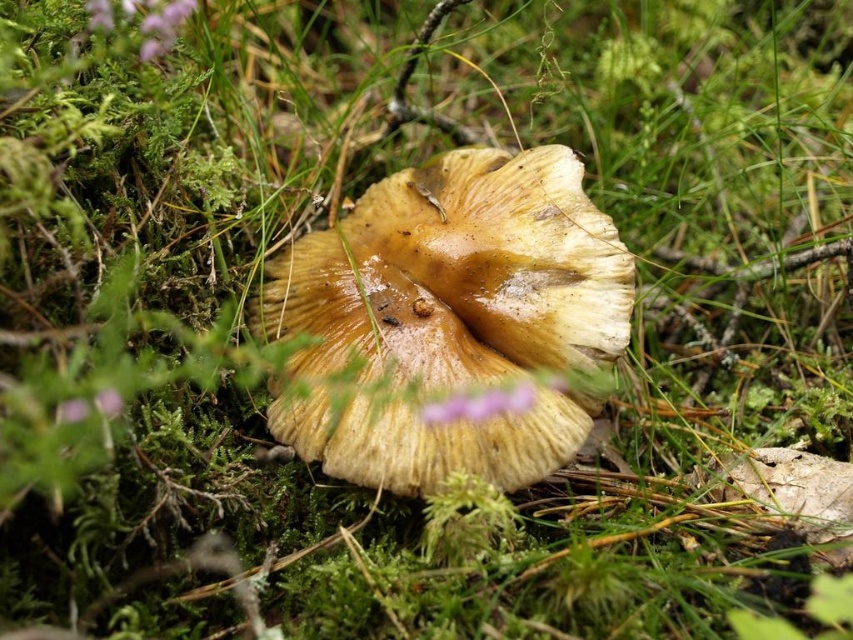
You are a botanist studying the spatial distribution of mushrooms in a forest. You have a map with coordinates. Where is the brown textured mushroom at center located on the map?

The brown textured mushroom at center is located at coordinates point (457, 275).

You are a botanist examining the forest floor. You notice the brown textured mushroom at center and the purple matte flower at upper left. Which object is positioned higher in the image?

The purple matte flower at upper left is positioned higher in the image than the brown textured mushroom at center.